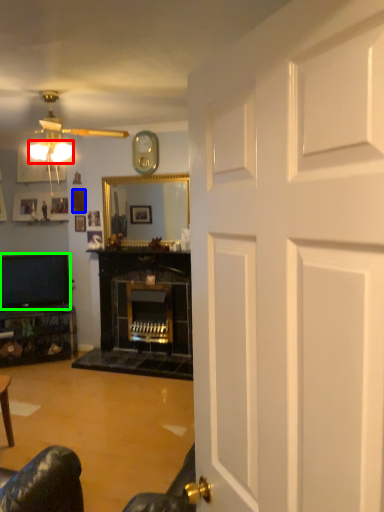
Question: Which is nearer to the lamp (highlighted by a red box)? picture frame (highlighted by a blue box) or television (highlighted by a green box).

Choices:
 (A) picture frame
 (B) television

Answer: (A)